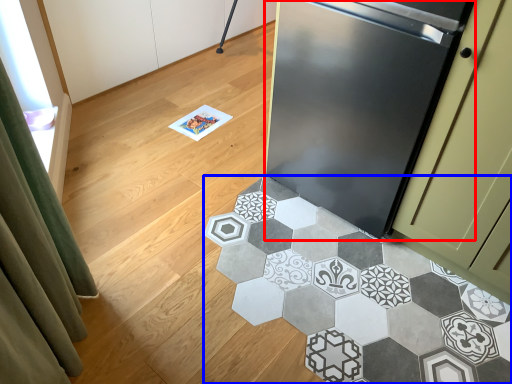
Question: Among these objects, which one is farthest to the camera, refrigerator (highlighted by a red box) or marble (highlighted by a blue box)?

Choices:
 (A) refrigerator
 (B) marble

Answer: (A)